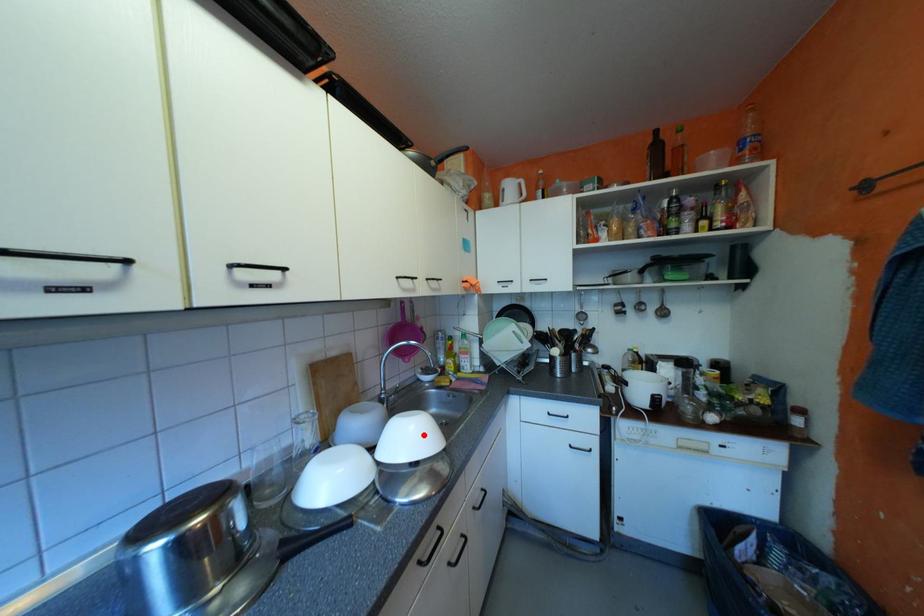
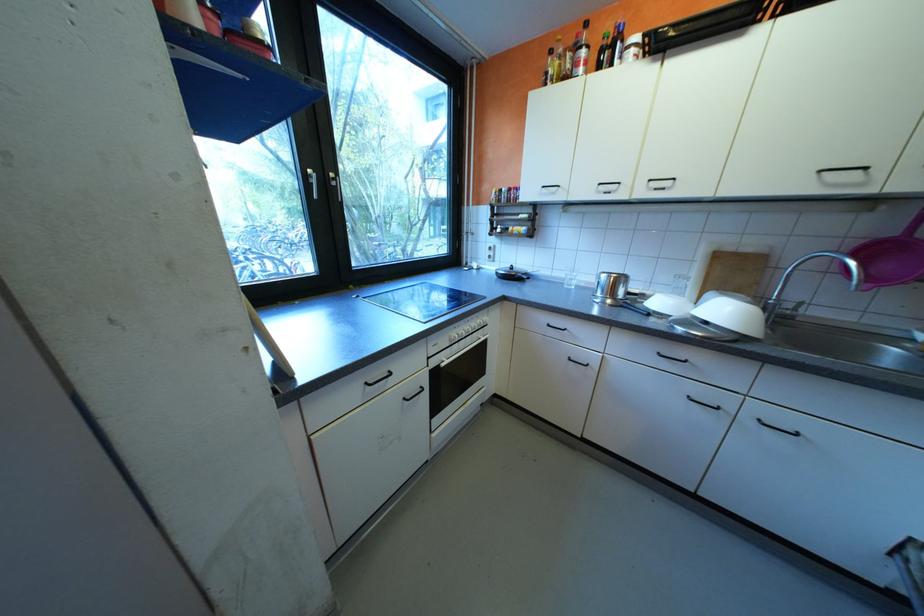
Question: A red point is marked in image1. In image2, is the corresponding 3D point closer to the camera or farther? Reply with the corresponding letter.

Choices:
 (A) The corresponding 3D point is closer.
 (B) The corresponding 3D point is farther.

Answer: (B)